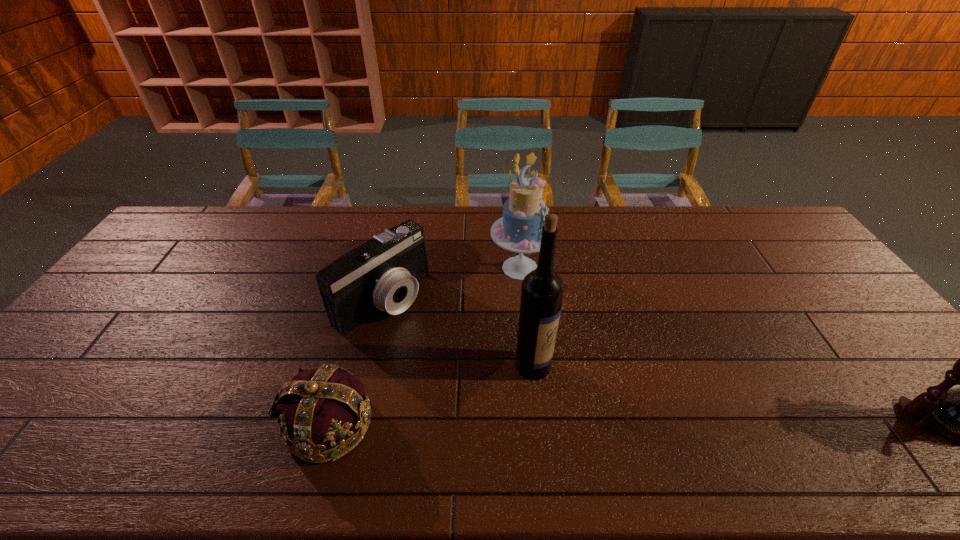
Image resolution: width=960 pixels, height=540 pixels. What are the coordinates of `free spot on the desktop that is between the shortest object and the rightmost object and is positioned on the label of the wine bottle` in the screenshot? It's located at (654, 423).

You are a GUI agent. You are given a task and a screenshot of the screen. Output one action in this format:
    pyautogui.click(x=<x>, y=<y>)
    Task: Click on the free space on the desktop that is between the crown and the rightmost object and is positioned on the lens of the second shortest object
    
    Given the screenshot: What is the action you would take?
    click(x=555, y=423)

Find the location of a particular element. Image resolution: width=960 pixels, height=540 pixels. vacant spot on the desktop that is between the crown and the hourglass and is positioned with a ladder on the side of the fourth shortest object is located at coordinates (677, 423).